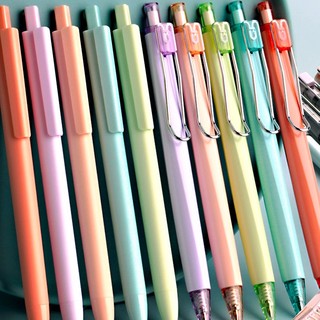
This screenshot has height=320, width=320. Find the location of `pen`. pen is located at coordinates (22, 162), (52, 159), (78, 156), (120, 156), (141, 156), (188, 159), (209, 159), (251, 153), (273, 151), (298, 150).